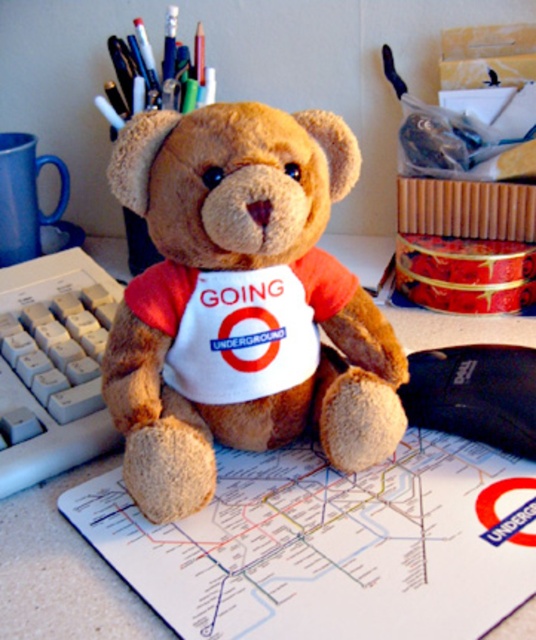
Question: Among these points, which one is nearest to the camera?

Choices:
 (A) (414, 422)
 (B) (152, 268)
 (C) (38, 378)
 (D) (94, 570)

Answer: (D)

Question: Is soft brown teddy bear at center wider than black fabric mouse at center?

Choices:
 (A) yes
 (B) no

Answer: (A)

Question: Is soft brown teddy bear at center to the left of white plastic keyboard at left from the viewer's perspective?

Choices:
 (A) no
 (B) yes

Answer: (A)

Question: Is white plastic keyboard at left below brown plush bear at center?

Choices:
 (A) yes
 (B) no

Answer: (B)

Question: Which object is closer to the camera taking this photo?

Choices:
 (A) soft brown teddy bear at center
 (B) black fabric mouse at center

Answer: (A)

Question: Considering the real-world distances, which object is closest to the white plastic keyboard at left?

Choices:
 (A) soft brown teddy bear at center
 (B) black fabric mouse at center
 (C) brown plush bear at center

Answer: (C)